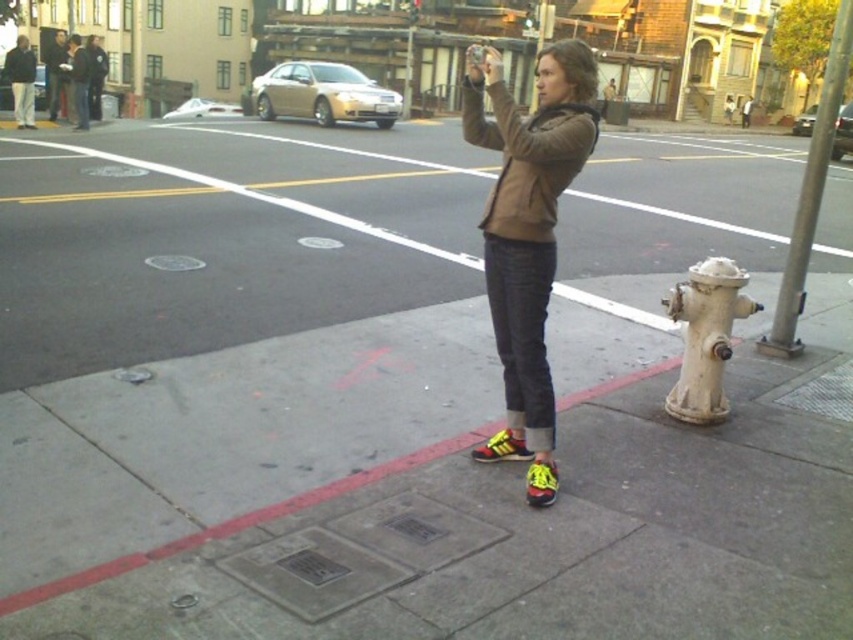
Question: Among these points, which one is nearest to the camera?

Choices:
 (A) (704, 403)
 (B) (531, 486)
 (C) (490, 452)

Answer: (B)

Question: Can you confirm if matte brown jacket at center is positioned to the left of white matte hydrant at lower right?

Choices:
 (A) yes
 (B) no

Answer: (A)

Question: Does red concrete curb at lower center lie behind metallic gray pole at right?

Choices:
 (A) yes
 (B) no

Answer: (B)

Question: Which point is farther from the camera taking this photo?

Choices:
 (A) (515, 451)
 (B) (531, 490)

Answer: (A)

Question: Does yellow synthetic shoe at center have a smaller size compared to yellow suede shoe at lower center?

Choices:
 (A) no
 (B) yes

Answer: (B)

Question: Estimate the real-world distances between objects in this image. Which object is closer to the matte brown jacket at center?

Choices:
 (A) yellow synthetic shoe at center
 (B) white matte hydrant at lower right
 (C) metallic gray pole at right

Answer: (A)